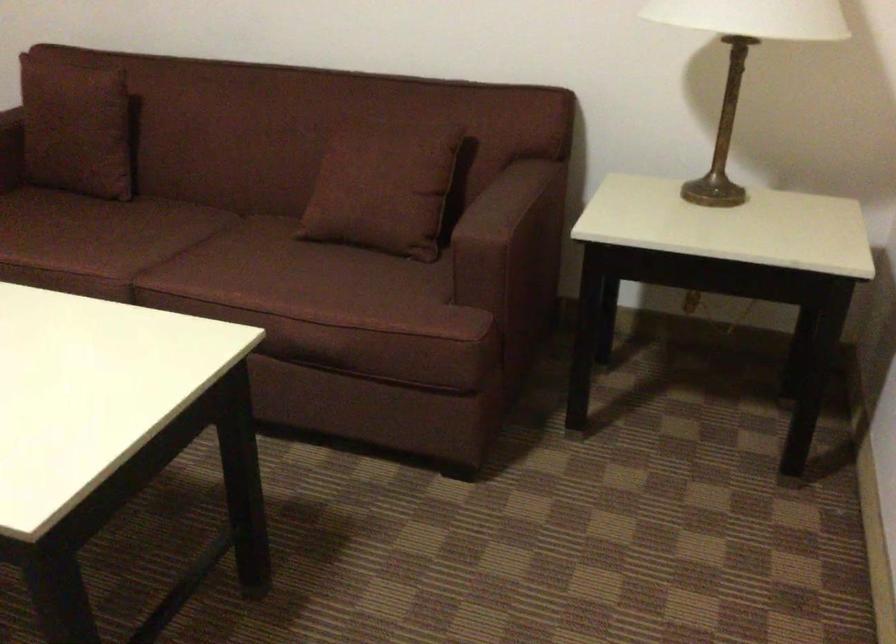
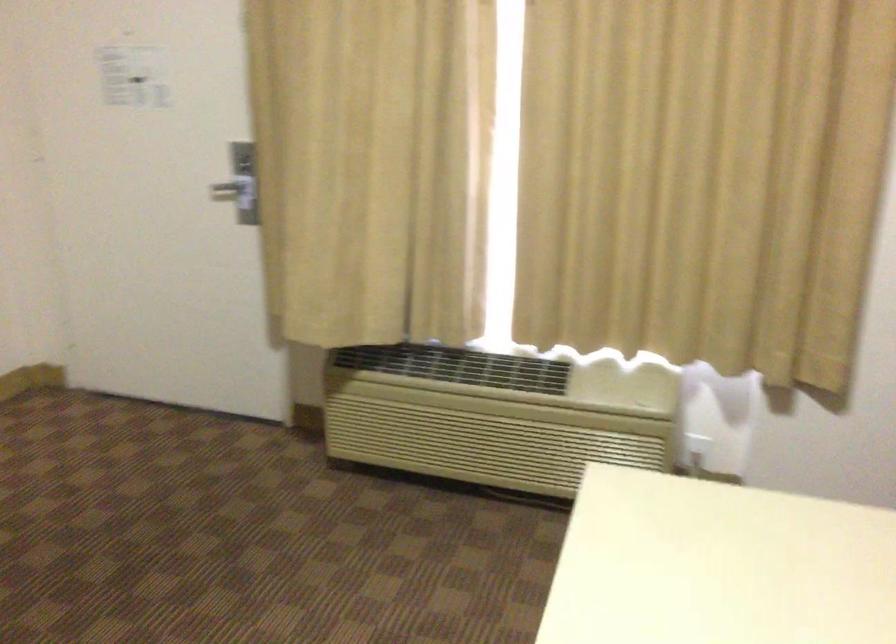
Question: The images are taken continuously from a first-person perspective. In which direction is your viewpoint rotating?

Choices:
 (A) Left
 (B) Right
 (C) Up
 (D) Down

Answer: (A)